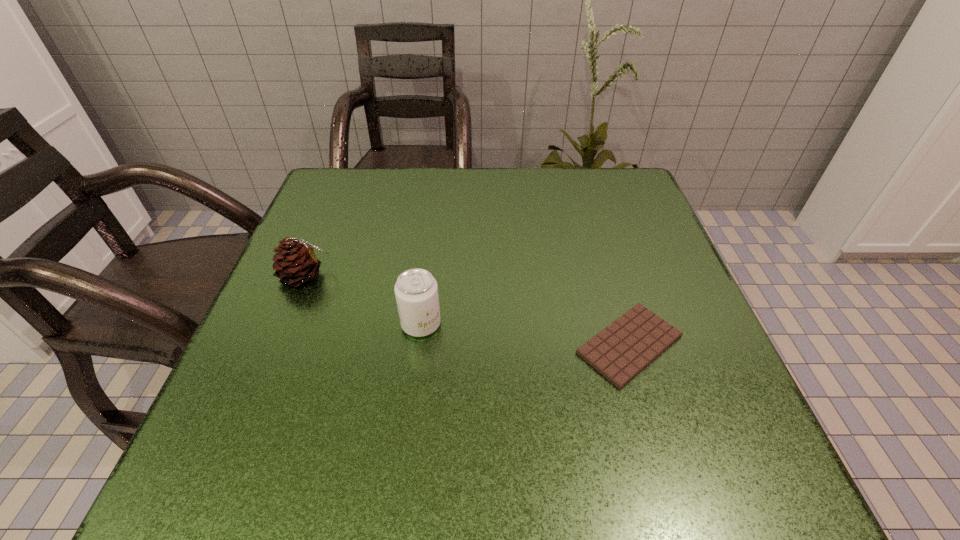
You are a GUI agent. You are given a task and a screenshot of the screen. Output one action in this format:
    pyautogui.click(x=<x>, y=<y>)
    Task: Click on the vacant space at the far edge
    The width and height of the screenshot is (960, 540).
    Given the screenshot: What is the action you would take?
    pyautogui.click(x=480, y=216)

Image resolution: width=960 pixels, height=540 pixels. I want to click on vacant space at the near edge, so click(565, 472).

In the image, there is a desktop. What are the coordinates of `free region at the left edge` in the screenshot? It's located at (336, 311).

This screenshot has width=960, height=540. In order to click on free location at the right edge in this screenshot , I will do `click(670, 284)`.

This screenshot has height=540, width=960. What are the coordinates of `vacant position at the far left corner of the desktop` in the screenshot? It's located at (368, 213).

In order to click on vacant space at the far right corner of the desktop in this screenshot , I will do `click(586, 178)`.

What are the coordinates of `empty space that is in between the pinecone and the soda can` in the screenshot? It's located at (363, 300).

The image size is (960, 540). In order to click on vacant space in between the farthest object and the rightmost object in this screenshot , I will do `click(468, 310)`.

The height and width of the screenshot is (540, 960). I want to click on empty space between the chocolate bar and the leftmost object, so click(x=468, y=310).

This screenshot has width=960, height=540. What are the coordinates of `vacant space in between the soda can and the chocolate bar` in the screenshot? It's located at (525, 334).